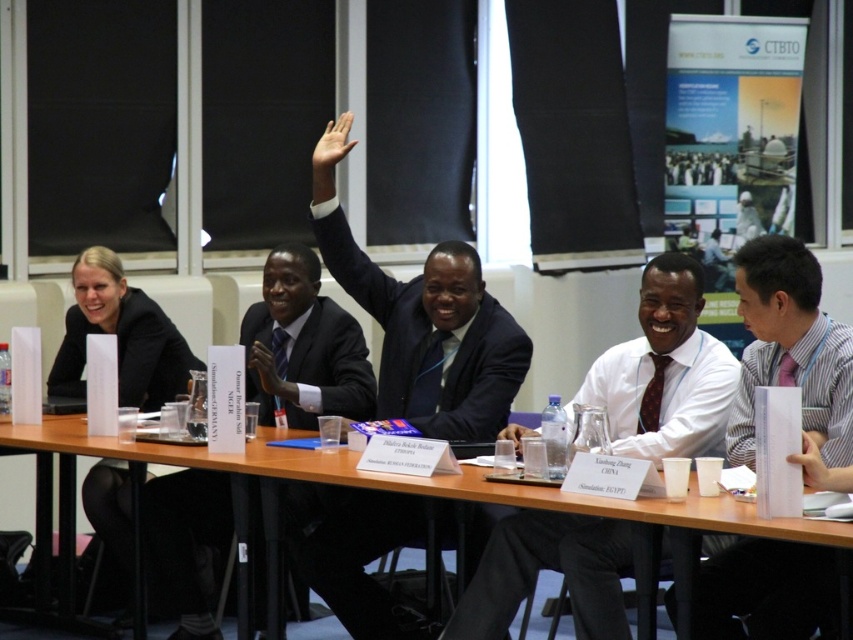
Question: Which of the following is the farthest from the observer?

Choices:
 (A) (370, 371)
 (B) (343, 140)

Answer: (A)

Question: Which point is farther to the camera?

Choices:
 (A) (339, 125)
 (B) (253, 353)

Answer: (B)

Question: Does purple striped shirt at center come in front of matte black hand at center?

Choices:
 (A) no
 (B) yes

Answer: (B)

Question: From the image, what is the correct spatial relationship of brown wooden table at center in relation to black suit at upper center?

Choices:
 (A) left
 (B) right

Answer: (A)

Question: Is white shirt at center smaller than purple striped shirt at center?

Choices:
 (A) yes
 (B) no

Answer: (B)

Question: Which object is the farthest from the matte black suit at left?

Choices:
 (A) matte white hand at upper center
 (B) brown wooden table at center

Answer: (A)